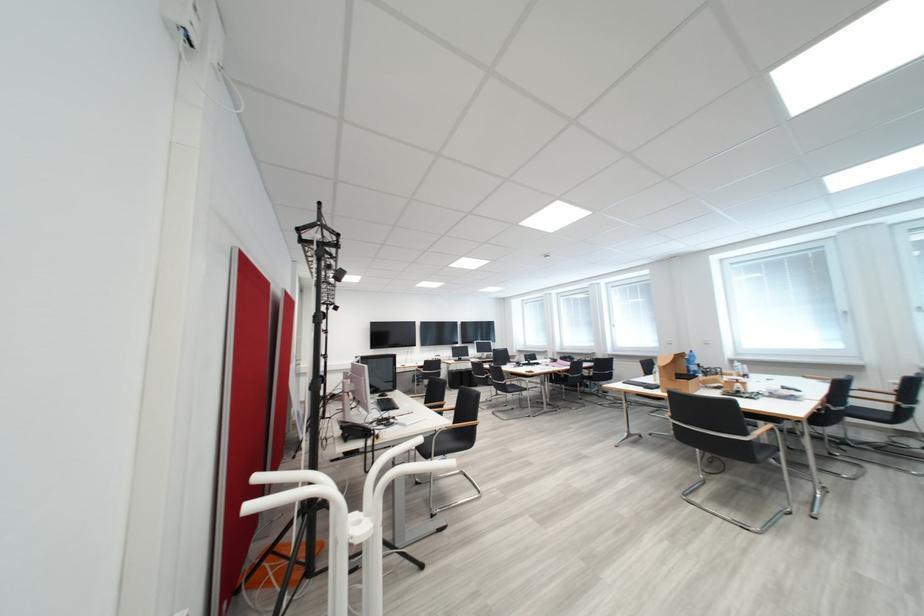
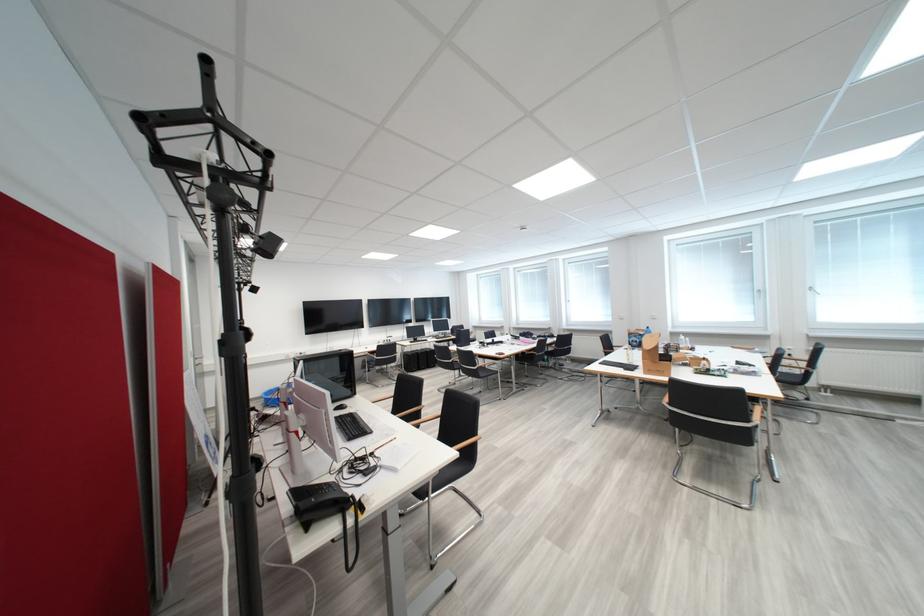
Where in the second image is the point corresponding to pixel 397 407 from the first image?

(365, 430)